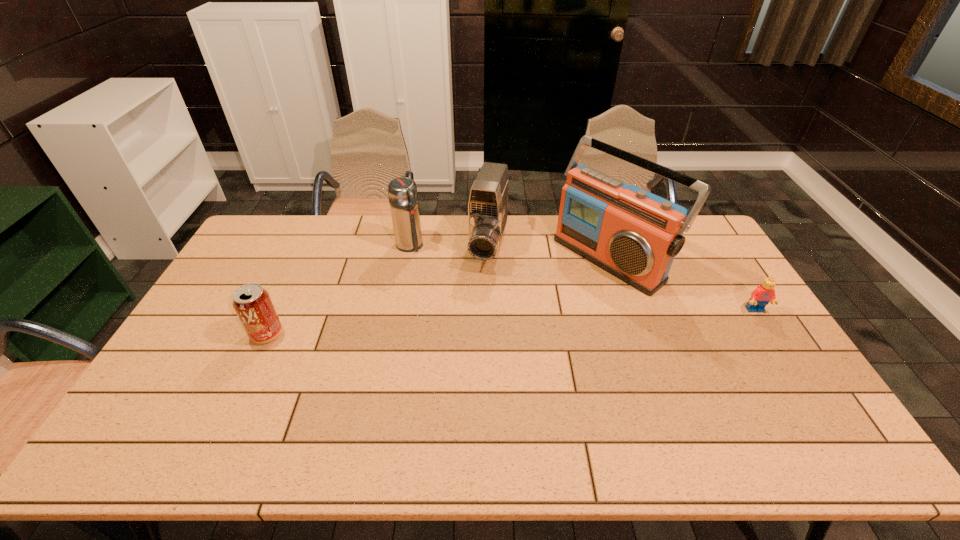
This screenshot has width=960, height=540. I want to click on free point that satisfies the following two spatial constraints: 1. on the back side of the fourth tallest object; 2. on the right side of the fourth object from left to right, so (302, 258).

This screenshot has width=960, height=540. Identify the location of free space that satisfies the following two spatial constraints: 1. on the front side of the thermos bottle; 2. on the right side of the camcorder. (409, 247).

Where is `vacant space that satisfies the following two spatial constraints: 1. on the back side of the nearest object; 2. on the right side of the fourth object from left to right`? Image resolution: width=960 pixels, height=540 pixels. vacant space that satisfies the following two spatial constraints: 1. on the back side of the nearest object; 2. on the right side of the fourth object from left to right is located at coordinates (302, 258).

I want to click on vacant region that satisfies the following two spatial constraints: 1. on the back side of the soda can; 2. on the left side of the thermos bottle, so click(x=308, y=246).